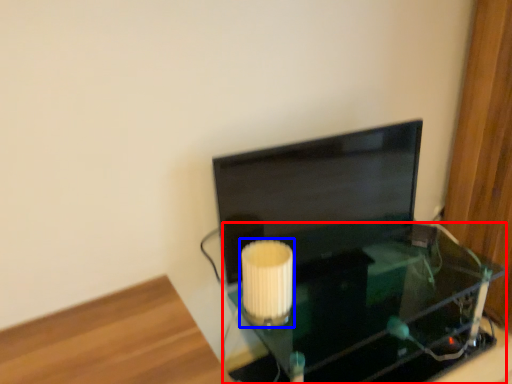
Question: Which object appears farthest to the camera in this image, table (highlighted by a red box) or lamp (highlighted by a blue box)?

Choices:
 (A) table
 (B) lamp

Answer: (B)